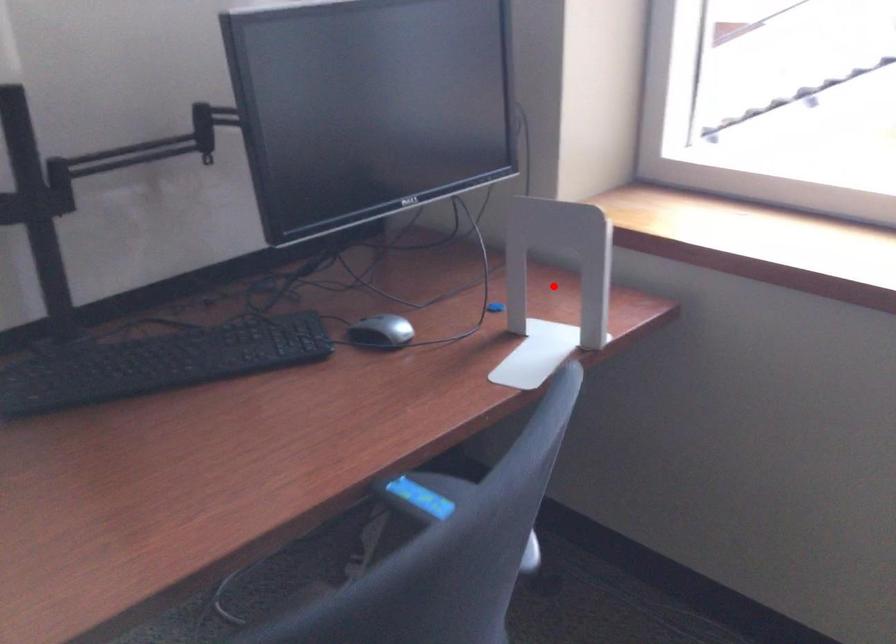
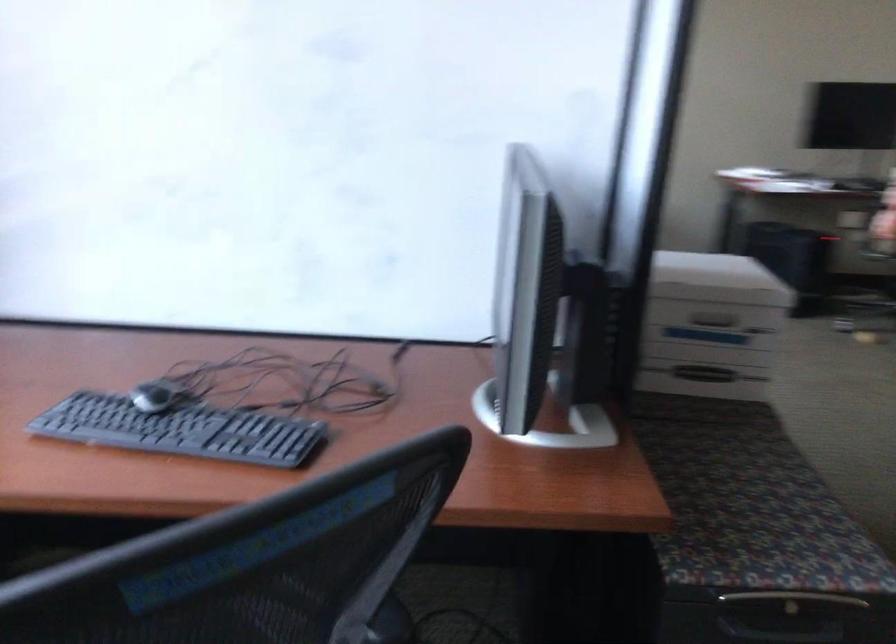
Question: I am providing you with two images of the same scene from different viewpoints. A red point is marked on the first image. At the location where the point appears in image 1, is it still visible in image 2?

Choices:
 (A) Yes
 (B) No

Answer: (B)